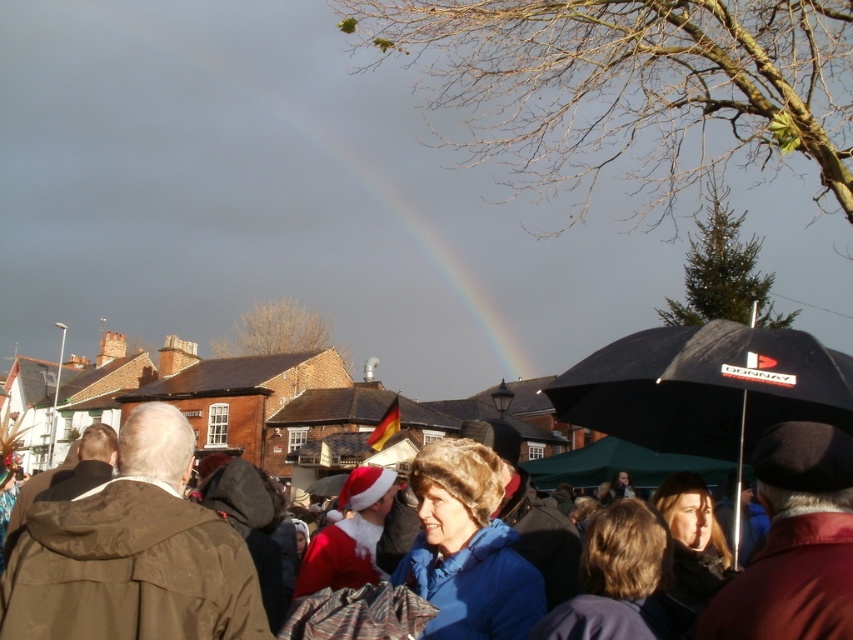
Who is more distant from viewer, [129,496] or [560,412]?

The point [560,412] is more distant.

This screenshot has height=640, width=853. Find the location of `blue woolen jacket at center`. blue woolen jacket at center is located at coordinates (125, 572).

This screenshot has width=853, height=640. I want to click on blue woolen jacket at center, so click(125, 572).